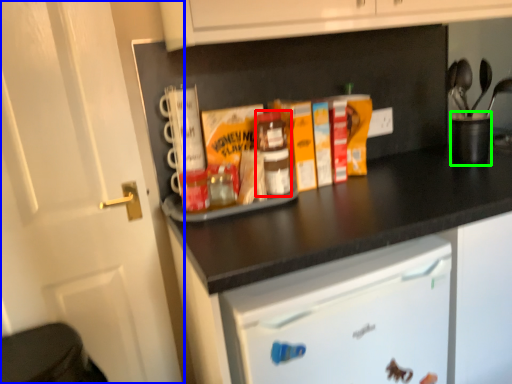
Question: Estimate the real-world distances between objects in this image. Which object is farther from bottle (highlighted by a red box), door (highlighted by a blue box) or appliance (highlighted by a green box)?

Choices:
 (A) door
 (B) appliance

Answer: (B)